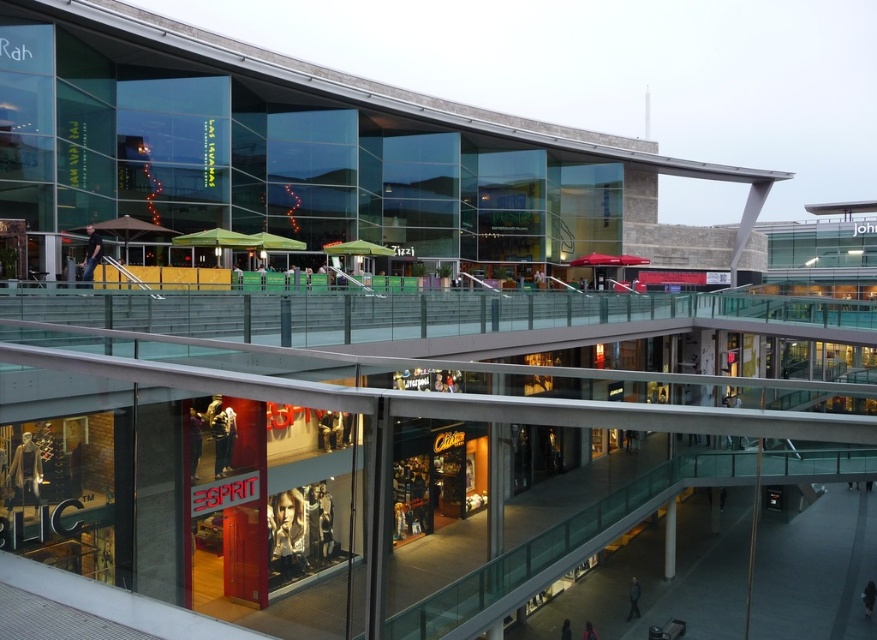
You are a customer in the mall and want to find the dark gray jacket at lower center. According to the coordinates provided, where should you look in the image?

The dark gray jacket at lower center is located at the 2D coordinates point (633, 598) in the image.

You are a store manager at the Esprit store and need to place a new display stand between the dark gray jacket at lower center and the dark blue jeans at lower center. The stand requires 1 meter of space. Can you fit it in the available space between them?

The dark gray jacket at lower center might be wider than dark blue jeans at lower center, but the exact width difference isn

You are standing at the entrance of the mall and want to locate the metallic silver poster at center. According to the mall layout, where should you look to find it?

The metallic silver poster at center is located at point (286, 532), so you should look towards the central area slightly to the right and lower middle section of the mall entrance.